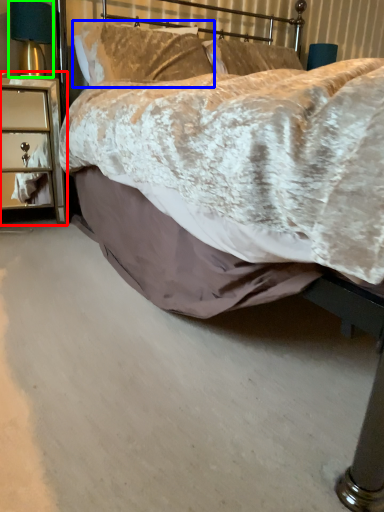
Question: Estimate the real-world distances between objects in this image. Which object is farther from nightstand (highlighted by a red box), pillow (highlighted by a blue box) or bedside lamp (highlighted by a green box)?

Choices:
 (A) pillow
 (B) bedside lamp

Answer: (A)